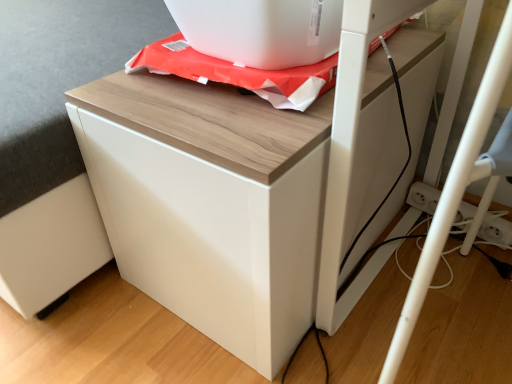
Question: From the image's perspective, is white glossy cabinet at center above or below white glossy appliance at upper center?

Choices:
 (A) above
 (B) below

Answer: (B)

Question: In the image, is white glossy cabinet at center on the left side or the right side of white glossy appliance at upper center?

Choices:
 (A) left
 (B) right

Answer: (A)

Question: Considering the positions of white glossy cabinet at center and white glossy appliance at upper center in the image, is white glossy cabinet at center taller or shorter than white glossy appliance at upper center?

Choices:
 (A) tall
 (B) short

Answer: (A)

Question: Is white glossy appliance at upper center wider or thinner than white glossy cabinet at center?

Choices:
 (A) thin
 (B) wide

Answer: (A)

Question: Relative to white glossy cabinet at center, is white glossy appliance at upper center in front or behind?

Choices:
 (A) behind
 (B) front

Answer: (A)

Question: Based on their positions, is white glossy appliance at upper center located to the left or right of white glossy cabinet at center?

Choices:
 (A) left
 (B) right

Answer: (B)

Question: Considering the positions of white glossy appliance at upper center and white glossy cabinet at center in the image, is white glossy appliance at upper center taller or shorter than white glossy cabinet at center?

Choices:
 (A) tall
 (B) short

Answer: (B)